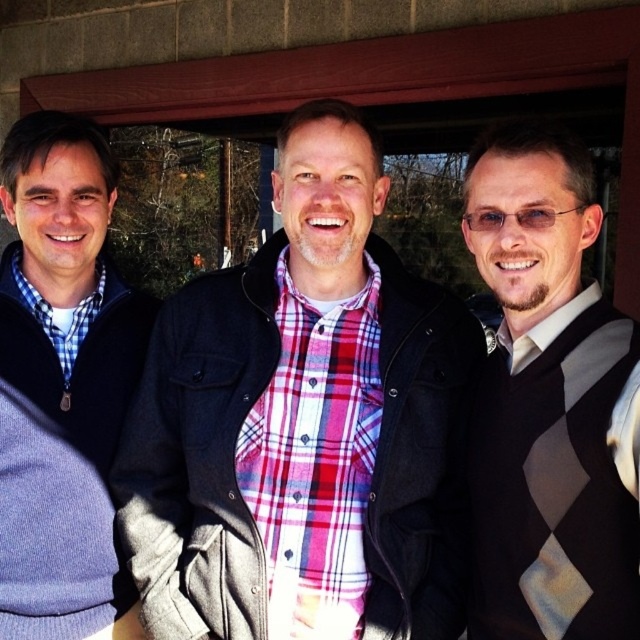
You are trying to decide which man to approach first based on their clothing. The plaid shirt at center and the argyle sweater vest at right are both visible. Which man should you approach if you want to speak to the taller one?

The plaid shirt at center is taller than the argyle sweater vest at right, so you should approach the man wearing the plaid shirt at center.

You are standing at the point with coordinates point (51,140) and want to walk to the point with coordinates point (541,284). Which direction should you move to reach your destination?

You should move forward because point (541,284) is in front of point (51,140).